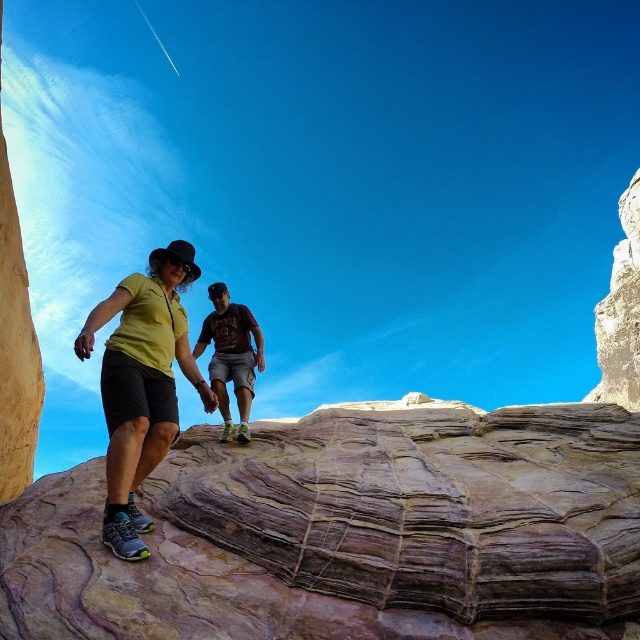
You are a hiker standing at the base of the rustic stone rock at center. You want to reach the top of the rock, which is 22.26 meters away. If your hiking gear can handle slopes up to 15 degrees, can you safely climb the rock?

The rustic stone rock at center is 22.26 meters away from the viewer. However, the angle of the slope isn being provided in the description, so it is impossible to determine if it is safe to climb based on the given information.